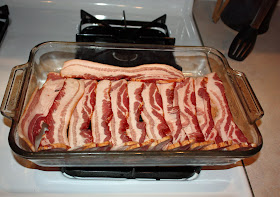
The width and height of the screenshot is (280, 197). Identify the location of stove grates. (145, 28), (175, 175), (4, 7).